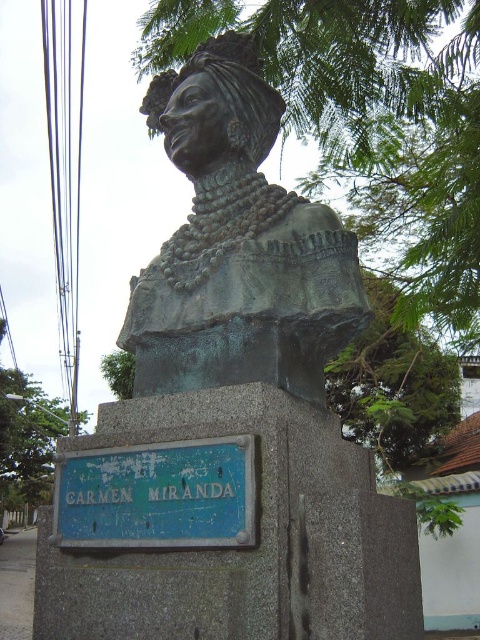
You are standing in front of the bronze bust of Carmen Miranda. There are two points marked on the bust. The first point is at coordinates point (242,481) and the second is at point (24,486). Which point is closer to you?

Point (242,481) is closer to the viewer than point (24,486).

You are a tourist standing in front of the bronze bust of Carmen Miranda. You want to take a photo of the blue painted metal sign at lower center. Where should you position yourself to ensure the sign is clearly visible in your photo?

To ensure the blue painted metal sign at lower center is clearly visible in your photo, position yourself directly in front of the bronze bust of Carmen Miranda at a distance where the sign at point (156, 496) is within your camera frame. Since the sign is at lower center, aiming your camera slightly downward towards the lower center area will capture it effectively.